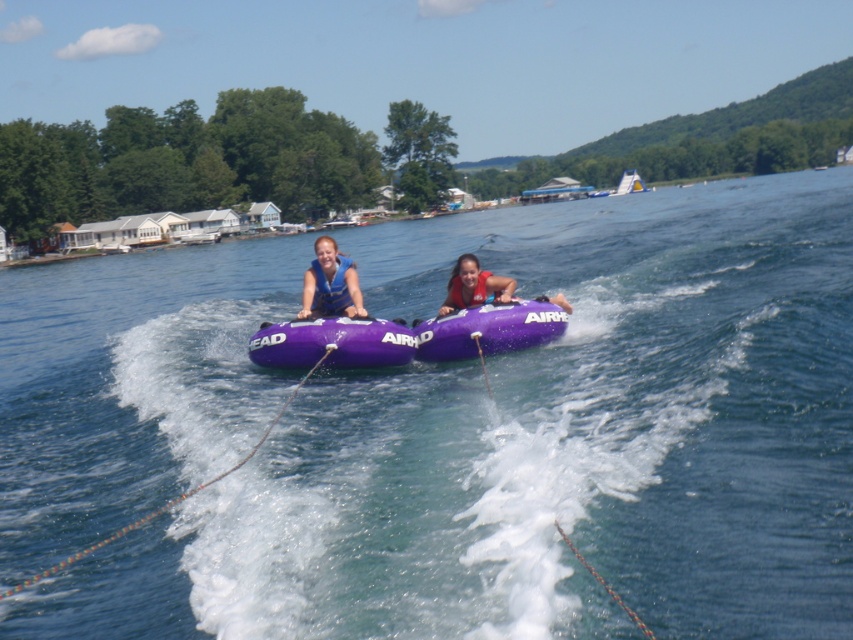
Can you confirm if purple rubber tube at center is shorter than purple fabric life jacket at center?

Incorrect, purple rubber tube at center's height does not fall short of purple fabric life jacket at center's.

The width and height of the screenshot is (853, 640). What do you see at coordinates (474, 285) in the screenshot? I see `purple rubber tube at center` at bounding box center [474, 285].

Identify the location of purple rubber tube at center. (474, 285).

Is matte blue life vest at center bigger than purple rubber tube at center?

Correct, matte blue life vest at center is larger in size than purple rubber tube at center.

Who is lower down, matte blue life vest at center or purple rubber tube at center?

purple rubber tube at center is lower down.

Identify the location of matte blue life vest at center. This screenshot has width=853, height=640. (329, 284).

Locate an element on the screen. The height and width of the screenshot is (640, 853). matte blue life vest at center is located at coordinates (329, 284).

Does purple rubber tubes at center lie behind purple fabric life jacket at center?

No, purple rubber tubes at center is in front of purple fabric life jacket at center.

Does purple rubber tubes at center appear under purple fabric life jacket at center?

Actually, purple rubber tubes at center is above purple fabric life jacket at center.

I want to click on purple rubber tubes at center, so click(543, 448).